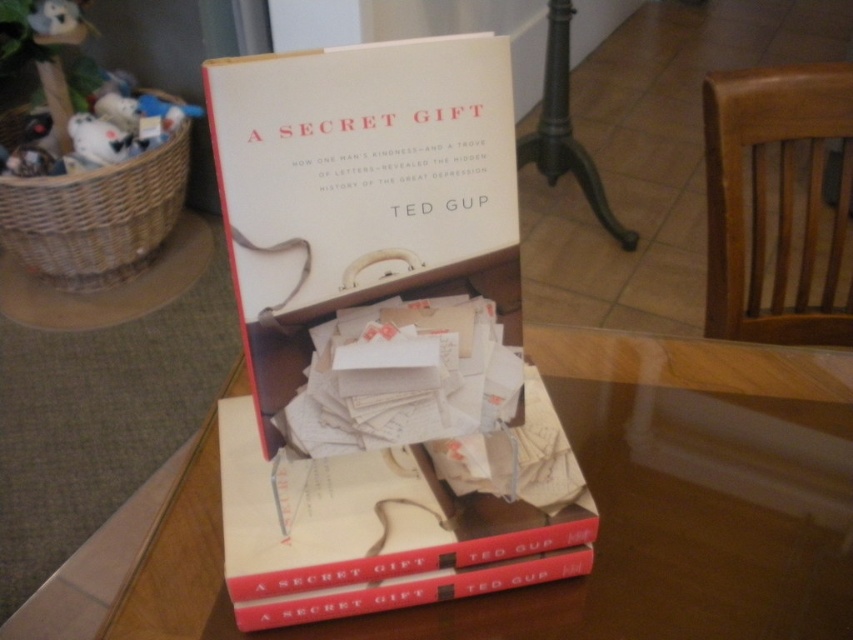
Question: Which is farther from the hardcover book at center?

Choices:
 (A) smooth wooden table at center
 (B) matte white book at center

Answer: (B)

Question: Is smooth wooden table at center above matte white book at center?

Choices:
 (A) yes
 (B) no

Answer: (B)

Question: Can you confirm if matte white book at center is smaller than hardcover book at center?

Choices:
 (A) no
 (B) yes

Answer: (B)

Question: Based on their relative distances, which object is nearer to the matte white book at center?

Choices:
 (A) woven brown basket at left
 (B) hardcover book at center

Answer: (B)

Question: Which is nearer to the smooth wooden table at center?

Choices:
 (A) hardcover book at center
 (B) woven brown basket at left

Answer: (A)

Question: Is hardcover book at center above woven brown basket at left?

Choices:
 (A) no
 (B) yes

Answer: (A)